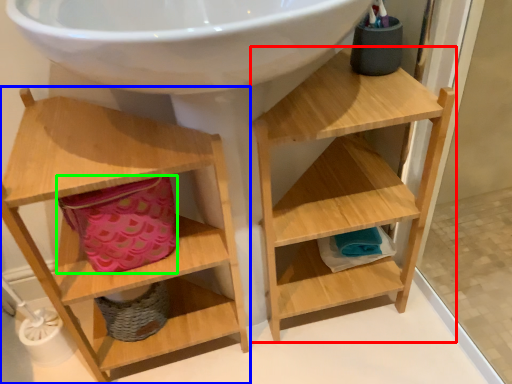
Question: Which object is the closest to the shelf (highlighted by a red box)? Choose among these: shelf (highlighted by a blue box) or basket (highlighted by a green box).

Choices:
 (A) shelf
 (B) basket

Answer: (A)